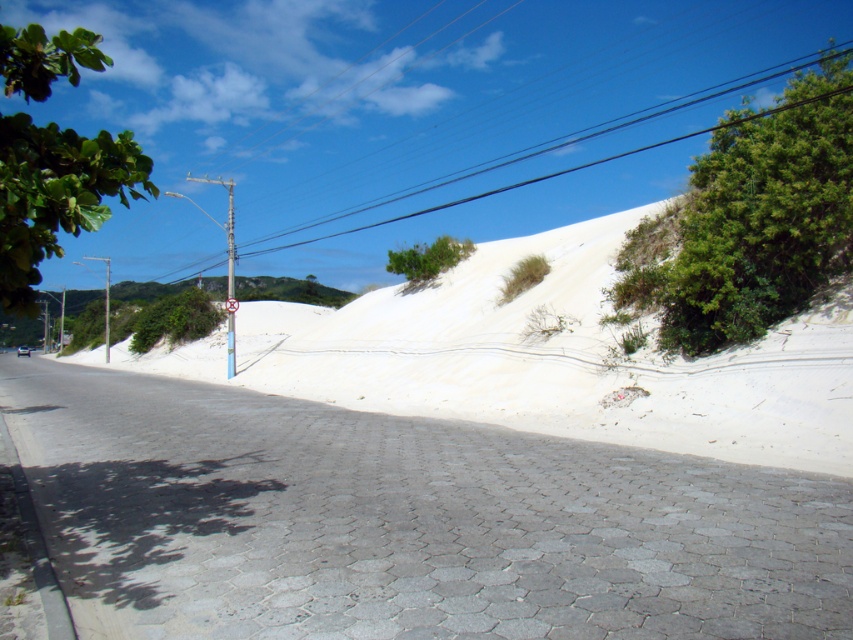
Based on the photo, you are standing at the edge of the white sand dune at center and want to walk to the green leafy tree at left. Which direction should you face to move towards it?

You should face upwards because the white sand dune at center is below the green leafy tree at left, so moving upward from the dune will lead towards the tree.

You are a hiker who needs to read the white plastic sign at upper center. There is a green leafy bush at upper center blocking your view. Can you see the sign clearly?

The green leafy bush at upper center is positioned over the white plastic sign at upper center, so it is blocking the view of the sign. You cannot see the sign clearly.